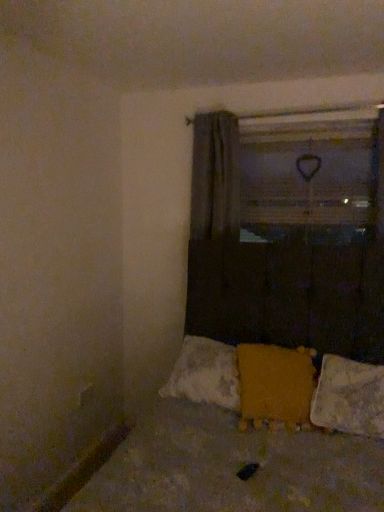
At what (x,y) coordinates should I click in order to perform the action: click on textured yellow fabric at lower center. Please return your answer as a coordinate pair (x, y). The width and height of the screenshot is (384, 512). Looking at the image, I should click on (245, 446).

Describe the element at coordinates (275, 385) in the screenshot. I see `yellow fuzzy pillow at lower center, which is the 1th pillow in left-to-right order` at that location.

What do you see at coordinates (309, 179) in the screenshot? This screenshot has height=512, width=384. I see `transparent plastic window screen at upper center` at bounding box center [309, 179].

Describe the element at coordinates (349, 397) in the screenshot. This screenshot has height=512, width=384. I see `white textured pillow at lower right, the second pillow positioned from the left` at that location.

I want to click on textured yellow fabric at lower center, so click(x=245, y=446).

Is point (259, 382) positioned behind point (363, 398)?

Yes, point (259, 382) is behind point (363, 398).

Is yellow fuzzy pillow at lower center, the 2th pillow from the right, facing away from white textured pillow at lower right, the first pillow from the right?

No.

Is yellow fuzzy pillow at lower center, the 2th pillow from the right, thinner than white textured pillow at lower right, the second pillow positioned from the left?

Indeed, yellow fuzzy pillow at lower center, the 2th pillow from the right, has a lesser width compared to white textured pillow at lower right, the second pillow positioned from the left.

In the scene shown: Which object is positioned more to the right, yellow fuzzy pillow at lower center, which is the 1th pillow in left-to-right order, or white textured pillow at lower right, the second pillow positioned from the left?

From the viewer's perspective, white textured pillow at lower right, the second pillow positioned from the left, appears more on the right side.

From a real-world perspective, is white textured pillow at lower right, the first pillow from the right, physically located above or below transparent plastic window screen at upper center?

white textured pillow at lower right, the first pillow from the right, is below transparent plastic window screen at upper center.

Which object is wider, white textured pillow at lower right, the first pillow from the right, or transparent plastic window screen at upper center?

white textured pillow at lower right, the first pillow from the right.

Locate an element on the screen. window screen above the white textured pillow at lower right, the first pillow from the right (from the image's perspective) is located at coordinates (309, 179).

Is white textured pillow at lower right, the second pillow positioned from the left, beside transparent plastic window screen at upper center?

No, white textured pillow at lower right, the second pillow positioned from the left, is not making contact with transparent plastic window screen at upper center.

In the scene shown: Is transparent plastic window screen at upper center positioned before yellow fabric at center?

No, it is behind yellow fabric at center.

Does transparent plastic window screen at upper center turn towards yellow fabric at center?

No, transparent plastic window screen at upper center does not turn towards yellow fabric at center.

Does transparent plastic window screen at upper center have a greater height compared to yellow fabric at center?

Yes, transparent plastic window screen at upper center is taller than yellow fabric at center.

Could you measure the distance between yellow fabric at center and white textured pillow at lower right, the first pillow from the right?

The distance of yellow fabric at center from white textured pillow at lower right, the first pillow from the right, is 5.49 inches.

Considering their positions, is yellow fabric at center located in front of or behind white textured pillow at lower right, the first pillow from the right?

Clearly, yellow fabric at center is behind white textured pillow at lower right, the first pillow from the right.

What's the angular difference between yellow fabric at center and white textured pillow at lower right, the second pillow positioned from the left,'s facing directions?

0.601 degrees.

I want to click on the 2nd pillow counting from the right of the yellow fabric at center, so click(x=349, y=397).

You are a GUI agent. You are given a task and a screenshot of the screen. Output one action in this format:
    pyautogui.click(x=<x>, y=<y>)
    Task: Click on the bedding behind the yellow fuzzy pillow at lower center, the 2th pillow from the right
    The width and height of the screenshot is (384, 512).
    Given the screenshot: What is the action you would take?
    pyautogui.click(x=280, y=386)

Does yellow fuzzy pillow at lower center, which is the 1th pillow in left-to-right order, have a smaller size compared to yellow fabric at center?

Correct, yellow fuzzy pillow at lower center, which is the 1th pillow in left-to-right order, occupies less space than yellow fabric at center.

Considering the sizes of yellow fuzzy pillow at lower center, which is the 1th pillow in left-to-right order, and yellow fabric at center in the image, is yellow fuzzy pillow at lower center, which is the 1th pillow in left-to-right order, wider or thinner than yellow fabric at center?

Considering their sizes, yellow fuzzy pillow at lower center, which is the 1th pillow in left-to-right order, looks broader than yellow fabric at center.

Is yellow fabric at center completely or partially inside yellow fuzzy pillow at lower center, the 2th pillow from the right?

Absolutely, yellow fabric at center is inside yellow fuzzy pillow at lower center, the 2th pillow from the right.

From the image's perspective, does textured yellow fabric at lower center appear lower than white textured pillow at lower right, the first pillow from the right?

Indeed, from the image's perspective, textured yellow fabric at lower center is shown beneath white textured pillow at lower right, the first pillow from the right.

Is textured yellow fabric at lower center in front of or behind white textured pillow at lower right, the first pillow from the right, in the image?

textured yellow fabric at lower center is positioned closer to the viewer than white textured pillow at lower right, the first pillow from the right.

In the scene shown: How far apart are textured yellow fabric at lower center and white textured pillow at lower right, the first pillow from the right?

They are 9.78 inches apart.

Can you confirm if textured yellow fabric at lower center is smaller than white textured pillow at lower right, the second pillow positioned from the left?

Incorrect, textured yellow fabric at lower center is not smaller in size than white textured pillow at lower right, the second pillow positioned from the left.

Considering the sizes of objects textured yellow fabric at lower center and yellow fabric at center in the image provided, who is thinner, textured yellow fabric at lower center or yellow fabric at center?

Thinner between the two is yellow fabric at center.

Would you say textured yellow fabric at lower center is to the left or to the right of yellow fabric at center in the picture?

In the image, textured yellow fabric at lower center appears on the left side of yellow fabric at center.

Between point (172, 502) and point (322, 420), which one is positioned in front?

The point (172, 502) is more forward.

The image size is (384, 512). I want to click on pillow located on the right of yellow fuzzy pillow at lower center, which is the 1th pillow in left-to-right order, so click(349, 397).

Image resolution: width=384 pixels, height=512 pixels. In order to click on the 2nd pillow in front of the transparent plastic window screen at upper center in this screenshot , I will do `click(349, 397)`.

Based on their spatial positions, is textured yellow fabric at lower center or yellow fabric at center closer to white textured pillow at lower right, the first pillow from the right?

Among the two, yellow fabric at center is located nearer to white textured pillow at lower right, the first pillow from the right.

Which object lies nearer to the anchor point textured yellow fabric at lower center, transparent plastic window screen at upper center or yellow fabric at center?

Among the two, yellow fabric at center is located nearer to textured yellow fabric at lower center.

Looking at the image, which one is located further to transparent plastic window screen at upper center, yellow fabric at center or yellow fuzzy pillow at lower center, the 2th pillow from the right?

Among the two, yellow fuzzy pillow at lower center, the 2th pillow from the right, is located further to transparent plastic window screen at upper center.

When comparing their distances from white textured pillow at lower right, the first pillow from the right, does yellow fabric at center or textured yellow fabric at lower center seem closer?

yellow fabric at center is positioned closer to the anchor white textured pillow at lower right, the first pillow from the right.

Considering their positions, is textured yellow fabric at lower center positioned closer to yellow fuzzy pillow at lower center, which is the 1th pillow in left-to-right order, than white textured pillow at lower right, the first pillow from the right?

Based on the image, white textured pillow at lower right, the first pillow from the right, appears to be nearer to yellow fuzzy pillow at lower center, which is the 1th pillow in left-to-right order.

Based on their spatial positions, is white textured pillow at lower right, the first pillow from the right, or transparent plastic window screen at upper center closer to textured yellow fabric at lower center?

white textured pillow at lower right, the first pillow from the right, lies closer to textured yellow fabric at lower center than the other object.

From the picture: Considering their positions, is transparent plastic window screen at upper center positioned further to white textured pillow at lower right, the first pillow from the right, than yellow fuzzy pillow at lower center, which is the 1th pillow in left-to-right order?

The object further to white textured pillow at lower right, the first pillow from the right, is transparent plastic window screen at upper center.

Which object lies nearer to the anchor point yellow fuzzy pillow at lower center, which is the 1th pillow in left-to-right order, white textured pillow at lower right, the second pillow positioned from the left, or transparent plastic window screen at upper center?

The object closer to yellow fuzzy pillow at lower center, which is the 1th pillow in left-to-right order, is white textured pillow at lower right, the second pillow positioned from the left.

You are a GUI agent. You are given a task and a screenshot of the screen. Output one action in this format:
    pyautogui.click(x=<x>, y=<y>)
    Task: Click on the pillow between transparent plastic window screen at upper center and white textured pillow at lower right, the second pillow positioned from the left, vertically
    The height and width of the screenshot is (512, 384).
    Given the screenshot: What is the action you would take?
    (x=275, y=385)

Identify the location of pillow between yellow fabric at center and white textured pillow at lower right, the first pillow from the right. This screenshot has width=384, height=512. (275, 385).

This screenshot has width=384, height=512. In order to click on bedding between transparent plastic window screen at upper center and yellow fuzzy pillow at lower center, which is the 1th pillow in left-to-right order, in the vertical direction in this screenshot , I will do `click(280, 386)`.

The width and height of the screenshot is (384, 512). In order to click on pillow positioned between textured yellow fabric at lower center and yellow fuzzy pillow at lower center, which is the 1th pillow in left-to-right order, from near to far in this screenshot , I will do `click(349, 397)`.